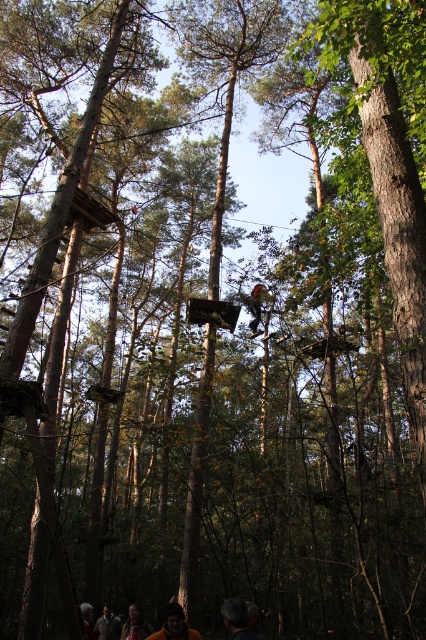
You are standing at the starting point of the obstacle course and see two points labeled as point (229, 608) and point (181, 627). Which point should you aim for first if you want to reach the nearest point to the camera?

You should aim for point (229, 608) first because it is closer to the camera compared to point (181, 627).

You are a participant in the obstacle course and need to move from the starting point to the finish line. The starting point is at point (232, 634) and the finish line is at point (132, 618). According to the image, which direction should you move to reach the finish line?

Point (232, 634) is in front of point (132, 618), so you should move backward to reach the finish line.

You are a photographer trying to capture both the dark brown leather jacket at lower center and the orange fabric jacket at lower center in the same frame. Based on their positions, which jacket should you adjust your camera angle to include first?

The dark brown leather jacket at lower center might be wider than orange fabric jacket at lower center, so you should adjust your camera angle to include the dark brown leather jacket at lower center first to ensure both fit in the frame.